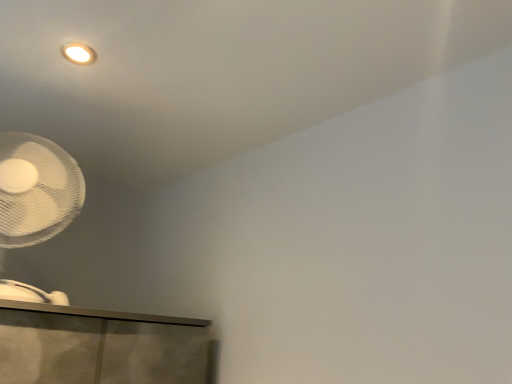
What do you see at coordinates (36, 189) in the screenshot?
I see `white matte mechanical fan at lower left` at bounding box center [36, 189].

The image size is (512, 384). I want to click on white matte mechanical fan at lower left, so click(x=36, y=189).

Where is `white matte mechanical fan at lower left`? white matte mechanical fan at lower left is located at coordinates (36, 189).